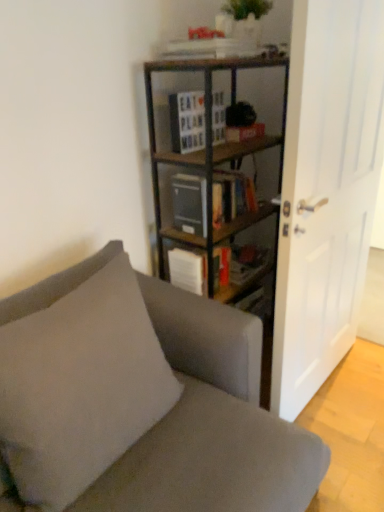
Describe the element at coordinates (326, 191) in the screenshot. I see `white matte door at right` at that location.

This screenshot has height=512, width=384. In order to click on wooden sign at center, the 2th book ordered from the bottom in this screenshot , I will do `click(187, 121)`.

From a real-world perspective, which is physically below, wooden bookcase at center or matte gray bookshelf at center, marked as the second book in a top-to-bottom arrangement?

wooden bookcase at center, from a real-world perspective.

Can you tell me how much wooden bookcase at center and matte gray bookshelf at center, which appears as the first book when ordered from the bottom, differ in facing direction?

1.13 degrees.

From the image's perspective, is wooden bookcase at center positioned above or below matte gray bookshelf at center, marked as the second book in a top-to-bottom arrangement?

wooden bookcase at center is below matte gray bookshelf at center, marked as the second book in a top-to-bottom arrangement.

Which is behind, wooden bookcase at center or matte gray bookshelf at center, marked as the second book in a top-to-bottom arrangement?

matte gray bookshelf at center, marked as the second book in a top-to-bottom arrangement, is behind.

You are a GUI agent. You are given a task and a screenshot of the screen. Output one action in this format:
    pyautogui.click(x=<x>, y=<y>)
    Task: Click on the shelf located on the left of white matte door at right
    The width and height of the screenshot is (384, 512).
    Given the screenshot: What is the action you would take?
    point(177,243)

Does wooden bookshelf at center have a greater width compared to white matte door at right?

Yes, wooden bookshelf at center is wider than white matte door at right.

Can you confirm if wooden bookshelf at center is smaller than white matte door at right?

Yes, wooden bookshelf at center is smaller than white matte door at right.

How distant is fabric couch at center from white matte door at right?

The distance of fabric couch at center from white matte door at right is 54.40 centimeters.

Which is closer, [220,423] or [322,184]?

Point [220,423] is closer to the camera than point [322,184].

Between fabric couch at center and white matte door at right, which one has larger size?

fabric couch at center is bigger.

Where is `door that is above the fabric couch at center (from the image's perspective)`? The height and width of the screenshot is (512, 384). door that is above the fabric couch at center (from the image's perspective) is located at coordinates (x=326, y=191).

From the image's perspective, is fabric couch at center positioned above or below wooden sign at center, arranged as the 1th book when viewed from the top?

fabric couch at center is situated lower than wooden sign at center, arranged as the 1th book when viewed from the top, in the image.

Is fabric couch at center with wooden sign at center, arranged as the 1th book when viewed from the top?

fabric couch at center and wooden sign at center, arranged as the 1th book when viewed from the top, are not in contact.

Which object is wider, fabric couch at center or wooden sign at center, the 2th book ordered from the bottom?

With larger width is fabric couch at center.

Considering the relative sizes of fabric couch at center and wooden sign at center, arranged as the 1th book when viewed from the top, in the image provided, is fabric couch at center taller than wooden sign at center, arranged as the 1th book when viewed from the top,?

Yes.

Which object is more forward, white matte door at right or fabric couch at center?

fabric couch at center is more forward.

Considering the sizes of white matte door at right and fabric couch at center in the image, is white matte door at right taller or shorter than fabric couch at center?

In the image, white matte door at right appears to be taller than fabric couch at center.

Is white matte door at right inside the boundaries of fabric couch at center, or outside?

white matte door at right is outside fabric couch at center.

Which is more to the left, white matte door at right or fabric couch at center?

fabric couch at center.

From a real-world perspective, is matte gray bookshelf at center, which appears as the first book when ordered from the bottom, physically below wooden bookshelf at center?

No.

Is matte gray bookshelf at center, marked as the second book in a top-to-bottom arrangement, turned away from wooden bookshelf at center?

No, matte gray bookshelf at center, marked as the second book in a top-to-bottom arrangement,'s orientation is not away from wooden bookshelf at center.

Does matte gray bookshelf at center, which appears as the first book when ordered from the bottom, lie in front of wooden bookshelf at center?

Yes, it is in front of wooden bookshelf at center.

Can you confirm if matte gray bookshelf at center, which appears as the first book when ordered from the bottom, is positioned to the right of wooden bookshelf at center?

Indeed, matte gray bookshelf at center, which appears as the first book when ordered from the bottom, is positioned on the right side of wooden bookshelf at center.

Considering the positions of points (176, 146) and (210, 125), is point (176, 146) closer to camera compared to point (210, 125)?

No, it is behind (210, 125).

Does wooden sign at center, arranged as the 1th book when viewed from the top, have a lesser height compared to wooden bookcase at center?

Yes.

Is wooden sign at center, arranged as the 1th book when viewed from the top, wider or thinner than wooden bookcase at center?

Clearly, wooden sign at center, arranged as the 1th book when viewed from the top, has less width compared to wooden bookcase at center.

From a real-world perspective, count 1st books upward from the wooden bookcase at center and point to it. Please provide its 2D coordinates.

[(190, 203)]

The width and height of the screenshot is (384, 512). Find the location of `shelf that appears behind the white matte door at right`. shelf that appears behind the white matte door at right is located at coordinates (177, 243).

Looking at the image, which one is located closer to wooden sign at center, the 2th book ordered from the bottom, white matte door at right or matte gray bookshelf at center, marked as the second book in a top-to-bottom arrangement?

matte gray bookshelf at center, marked as the second book in a top-to-bottom arrangement, lies closer to wooden sign at center, the 2th book ordered from the bottom, than the other object.

Looking at the image, which one is located further to wooden sign at center, arranged as the 1th book when viewed from the top, matte gray bookshelf at center, marked as the second book in a top-to-bottom arrangement, or wooden bookcase at center?

The object further to wooden sign at center, arranged as the 1th book when viewed from the top, is matte gray bookshelf at center, marked as the second book in a top-to-bottom arrangement.

From the image, which object appears to be farther from white matte door at right, fabric couch at center or wooden bookcase at center?

Among the two, fabric couch at center is located further to white matte door at right.

Estimate the real-world distances between objects in this image. Which object is closer to matte gray bookshelf at center, which appears as the first book when ordered from the bottom, wooden bookcase at center or fabric couch at center?

wooden bookcase at center lies closer to matte gray bookshelf at center, which appears as the first book when ordered from the bottom, than the other object.

From the picture: Which object lies further to the anchor point wooden bookshelf at center, wooden sign at center, arranged as the 1th book when viewed from the top, or fabric couch at center?

The object further to wooden bookshelf at center is fabric couch at center.

Based on their spatial positions, is fabric couch at center or wooden sign at center, arranged as the 1th book when viewed from the top, further from matte gray bookshelf at center, marked as the second book in a top-to-bottom arrangement?

fabric couch at center lies further to matte gray bookshelf at center, marked as the second book in a top-to-bottom arrangement, than the other object.

Estimate the real-world distances between objects in this image. Which object is further from white matte door at right, fabric couch at center or wooden sign at center, the 2th book ordered from the bottom?

wooden sign at center, the 2th book ordered from the bottom, is further to white matte door at right.

Estimate the real-world distances between objects in this image. Which object is further from matte gray bookshelf at center, marked as the second book in a top-to-bottom arrangement, white matte door at right or fabric couch at center?

Answer: fabric couch at center lies further to matte gray bookshelf at center, marked as the second book in a top-to-bottom arrangement, than the other object.

Where is `book positioned between white matte door at right and matte gray bookshelf at center, marked as the second book in a top-to-bottom arrangement, from near to far`? This screenshot has height=512, width=384. book positioned between white matte door at right and matte gray bookshelf at center, marked as the second book in a top-to-bottom arrangement, from near to far is located at coordinates (187, 121).

The height and width of the screenshot is (512, 384). Identify the location of bookcase that lies between wooden sign at center, arranged as the 1th book when viewed from the top, and fabric couch at center from top to bottom. (206, 135).

Image resolution: width=384 pixels, height=512 pixels. In order to click on book positioned between fabric couch at center and matte gray bookshelf at center, marked as the second book in a top-to-bottom arrangement, from near to far in this screenshot , I will do `click(187, 121)`.

The height and width of the screenshot is (512, 384). In order to click on book between wooden sign at center, the 2th book ordered from the bottom, and wooden bookshelf at center in the up-down direction in this screenshot , I will do `click(190, 203)`.